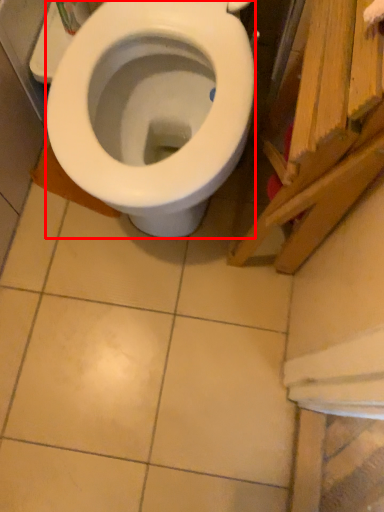
Question: From the image's perspective, what is the correct spatial relationship of bidet (annotated by the red box) in relation to wood?

Choices:
 (A) below
 (B) above

Answer: (B)